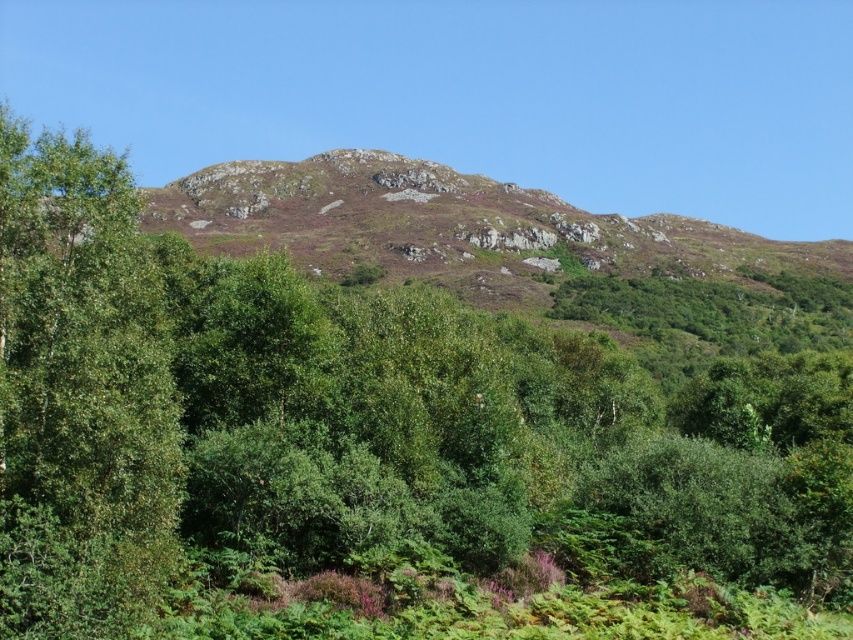
You are planning a hiking route and need to decide whether to pass between the green leafy tree at left and the rusty rock mountain at center. Given that your path must be at least 2 meters wide, can you determine if the space between them is wide enough?

The green leafy tree at left is thinner than the rusty rock mountain at center, but the exact width between them isn not provided. Without specific distance information, it is impossible to determine if the path is at least 2 meters wide.

You are a hiker planning to take a photo of the rusty rock mountain at center. However, you notice the green leafy tree at left might block your view. Based on the scene description, can you determine if the tree is in front of or behind the mountain?

The green leafy tree at left is in front of the rusty rock mountain at center, so it will block the view of the mountain.

You are standing in the lush green landscape described. There is a point at coordinates point (79, 444). If you want to place a flag there, will you be able to reach it without moving closer than 90 feet from your current position?

The point (79, 444) is 91.84 feet from the viewer, so you cannot reach it without moving closer than 90 feet because it is farther away than that distance.